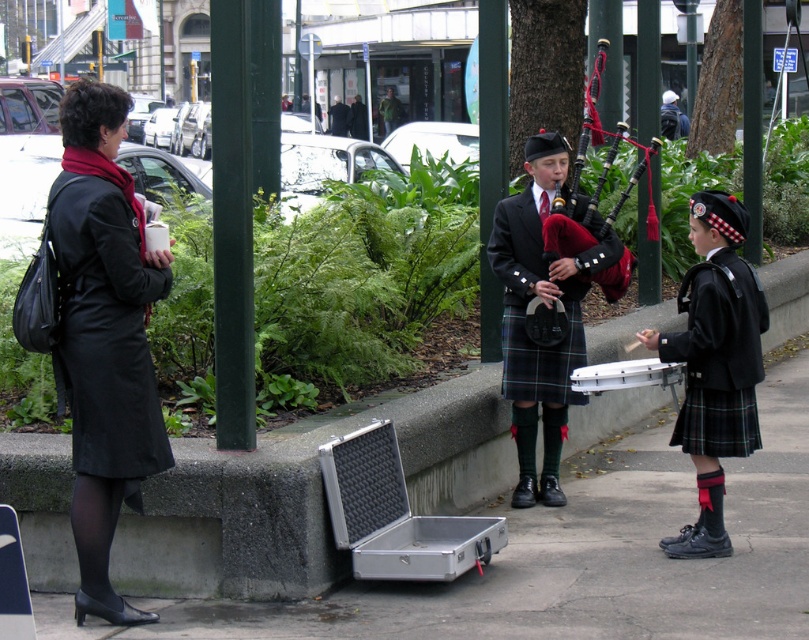
Question: Among these objects, which one is nearest to the camera?

Choices:
 (A) dark green kilt at center
 (B) metallic case at lower center
 (C) red velvet bagpipe at center
 (D) plaid fabric skirt at lower right

Answer: (B)

Question: Can you confirm if plaid wool kilt at center is thinner than dark green kilt at center?

Choices:
 (A) no
 (B) yes

Answer: (B)

Question: Does metallic case at lower center come behind green fabric jacket at center?

Choices:
 (A) yes
 (B) no

Answer: (B)

Question: Which point is farther to the camera?

Choices:
 (A) (585, 257)
 (B) (634, 376)
 (C) (354, 125)

Answer: (C)

Question: Where is plaid fabric skirt at lower right located in relation to dark blue suit at center in the image?

Choices:
 (A) below
 (B) above

Answer: (A)

Question: Which point appears farthest from the camera in this image?

Choices:
 (A) (566, 400)
 (B) (354, 134)
 (C) (684, 131)

Answer: (B)